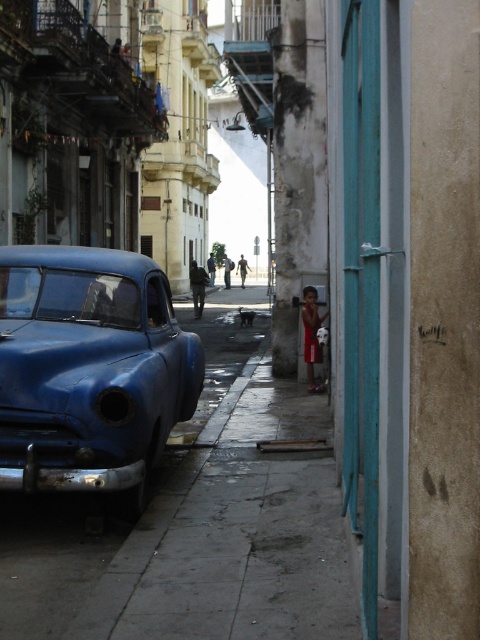
You are a delivery person trying to navigate a narrow street with a small cart. You see a matte blue car at left and a red fabric shirt at lower right. Which object takes up more horizontal space in the scene?

The matte blue car at left is wider than the red fabric shirt at lower right, so it takes up more horizontal space in the scene.

You are a delivery person standing at the red fabric shirt at lower right and need to reach the matte blue car at left. The delivery cart you are pushing is 2 feet wide. The street between the two objects is 17 feet wide. Can you safely navigate the cart to the car without going off the street?

The distance between the matte blue car at left and the red fabric shirt at lower right is 16.78 feet. The street is 17 feet wide, which is just slightly wider than the distance between the two objects. However, the cart is only 2 feet wide, so as long as you stay centered on the street, there should be enough space to navigate safely to the car.

You are a pedestrian standing on the street and want to cross to the other side. There is a matte blue car at left and a red fabric shirt at lower right in your view. Which object is closer to you as you decide to step into the road?

The matte blue car at left is closer to the viewer than the red fabric shirt at lower right, so the matte blue car at left is closer to you.